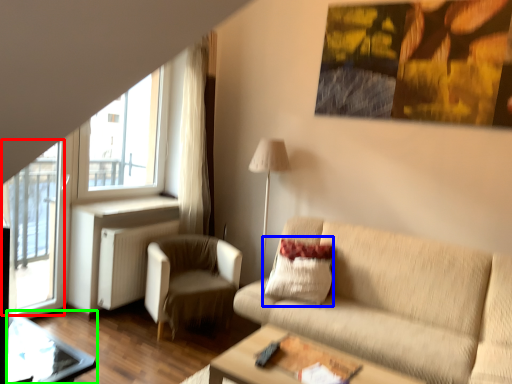
Question: Based on their relative distances, which object is farther from screen door (highlighted by a red box)? Choose from pillow (highlighted by a blue box) and glass table (highlighted by a green box).

Choices:
 (A) pillow
 (B) glass table

Answer: (A)